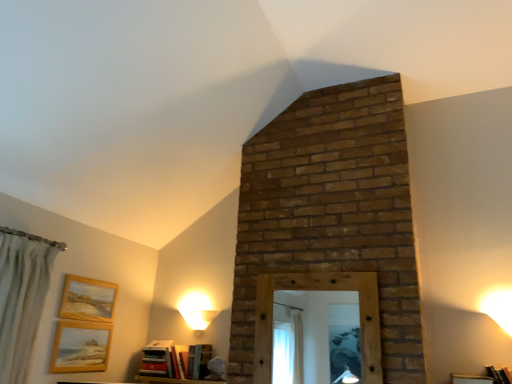
Question: Should I look upward or downward to see hardcover books at lower center, acting as the second book starting from the left?

Choices:
 (A) down
 (B) up

Answer: (A)

Question: Can you confirm if wooden bookshelf at lower center, which is counted as the second furniture, starting from the top, is thinner than wooden frame at lower right, marked as the 1th furniture in a right-to-left arrangement?

Choices:
 (A) no
 (B) yes

Answer: (A)

Question: Does wooden bookshelf at lower center, which appears as the 1th furniture when viewed from the back, have a lesser height compared to wooden frame at lower right, which ranks as the first furniture in top-to-bottom order?

Choices:
 (A) no
 (B) yes

Answer: (B)

Question: Is wooden bookshelf at lower center, the second furniture positioned from the right, placed right next to wooden frame at lower right, acting as the second furniture starting from the bottom?

Choices:
 (A) yes
 (B) no

Answer: (B)

Question: Can you confirm if wooden bookshelf at lower center, which ranks as the 2th furniture in front-to-back order, is bigger than wooden frame at lower right, marked as the 1th furniture in a right-to-left arrangement?

Choices:
 (A) no
 (B) yes

Answer: (B)

Question: Does wooden bookshelf at lower center, which ranks as the 2th furniture in front-to-back order, lie in front of wooden frame at lower right, acting as the second furniture starting from the bottom?

Choices:
 (A) no
 (B) yes

Answer: (A)

Question: Is wooden bookshelf at lower center, which is counted as the second furniture, starting from the top, turned away from wooden frame at lower right, acting as the second furniture starting from the bottom?

Choices:
 (A) no
 (B) yes

Answer: (A)

Question: Is hardcover books at lower center, acting as the second book starting from the left, behind wooden picture frame at upper left, the first picture frame in the top-to-bottom sequence?

Choices:
 (A) no
 (B) yes

Answer: (B)

Question: Does hardcover books at lower center, the 2th book when ordered from right to left, have a larger size compared to wooden picture frame at upper left, the first picture frame in the top-to-bottom sequence?

Choices:
 (A) no
 (B) yes

Answer: (B)

Question: Can you confirm if hardcover books at lower center, the 2th book when ordered from right to left, is positioned to the left of wooden picture frame at upper left, arranged as the second picture frame when ordered from the bottom?

Choices:
 (A) no
 (B) yes

Answer: (A)

Question: From a real-world perspective, is hardcover books at lower center, acting as the second book starting from the left, physically above wooden picture frame at upper left, the first picture frame in the top-to-bottom sequence?

Choices:
 (A) no
 (B) yes

Answer: (A)

Question: Does hardcover books at lower center, acting as the second book starting from the left, turn towards wooden picture frame at upper left, the first picture frame in the top-to-bottom sequence?

Choices:
 (A) yes
 (B) no

Answer: (B)

Question: Considering the relative positions of hardcover books at lower center, acting as the second book starting from the left, and wooden picture frame at upper left, the first picture frame in the top-to-bottom sequence, in the image provided, is hardcover books at lower center, acting as the second book starting from the left, to the right of wooden picture frame at upper left, the first picture frame in the top-to-bottom sequence, from the viewer's perspective?

Choices:
 (A) no
 (B) yes

Answer: (B)

Question: From a real-world perspective, is hardcover books at lower center, the 2th book when ordered from right to left, located beneath green textured curtain at left?

Choices:
 (A) yes
 (B) no

Answer: (A)